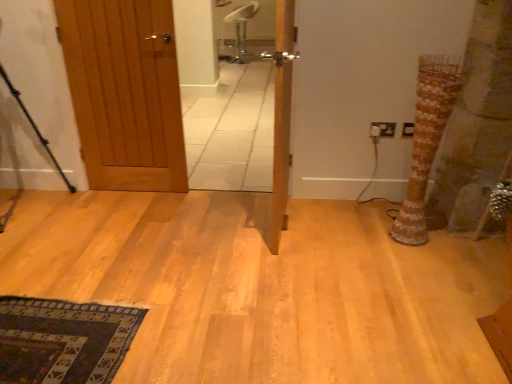
Question: Can you confirm if black metal tripod at left is positioned to the right of wooden door at center, which is counted as the 1th door, starting from the right?

Choices:
 (A) no
 (B) yes

Answer: (A)

Question: Is black metal tripod at left taller than wooden door at center, which is counted as the 1th door, starting from the right?

Choices:
 (A) no
 (B) yes

Answer: (A)

Question: Could you tell me if black metal tripod at left is facing wooden door at center, which is counted as the second door, starting from the left?

Choices:
 (A) no
 (B) yes

Answer: (A)

Question: Does black metal tripod at left touch wooden door at center, which is counted as the 1th door, starting from the right?

Choices:
 (A) yes
 (B) no

Answer: (B)

Question: Does black metal tripod at left come behind wooden door at center, which is counted as the second door, starting from the left?

Choices:
 (A) no
 (B) yes

Answer: (B)

Question: From a real-world perspective, does black metal tripod at left sit lower than wooden door at center, which is counted as the second door, starting from the left?

Choices:
 (A) no
 (B) yes

Answer: (B)

Question: Is striped fabric tree trunk at right wider than black metal tripod at left?

Choices:
 (A) no
 (B) yes

Answer: (A)

Question: Does striped fabric tree trunk at right have a smaller size compared to black metal tripod at left?

Choices:
 (A) no
 (B) yes

Answer: (B)

Question: Considering the relative sizes of striped fabric tree trunk at right and black metal tripod at left in the image provided, is striped fabric tree trunk at right thinner than black metal tripod at left?

Choices:
 (A) no
 (B) yes

Answer: (B)

Question: Does striped fabric tree trunk at right appear on the right side of black metal tripod at left?

Choices:
 (A) yes
 (B) no

Answer: (A)

Question: Considering the relative sizes of striped fabric tree trunk at right and black metal tripod at left in the image provided, is striped fabric tree trunk at right bigger than black metal tripod at left?

Choices:
 (A) no
 (B) yes

Answer: (A)

Question: Does striped fabric tree trunk at right turn towards black metal tripod at left?

Choices:
 (A) no
 (B) yes

Answer: (B)

Question: Are wooden door at left, marked as the second door in a right-to-left arrangement, and wooden door at center, which is counted as the 1th door, starting from the right, beside each other?

Choices:
 (A) yes
 (B) no

Answer: (B)